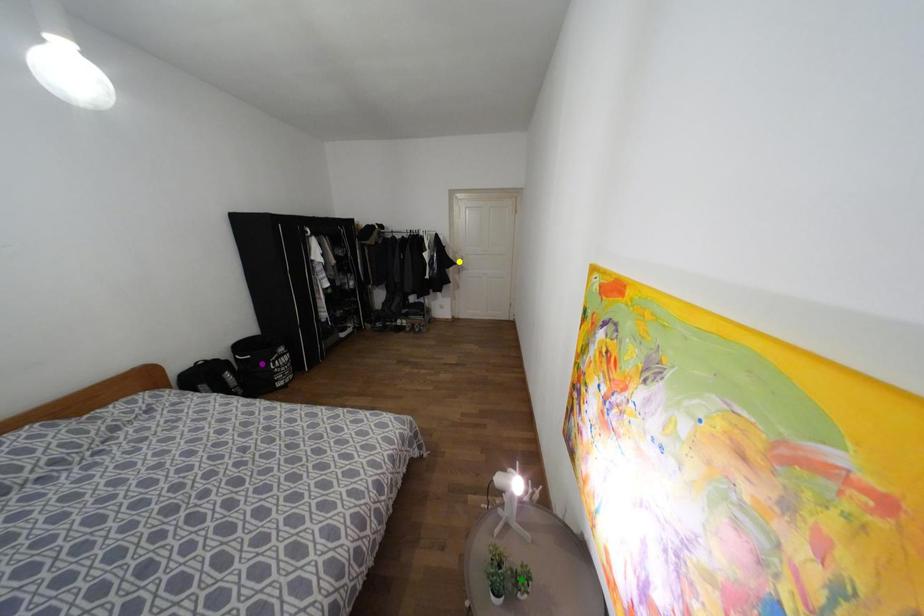
Looking at this image, order these from nearest to farthest:
A) purple point
B) green point
C) yellow point

green point < purple point < yellow point